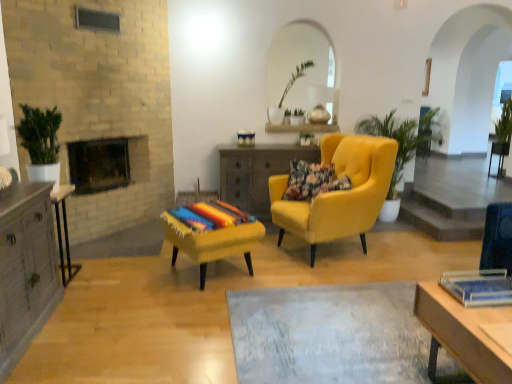
Question: Considering the positions of point (105, 142) and point (399, 152), is point (105, 142) closer or farther from the camera than point (399, 152)?

Choices:
 (A) closer
 (B) farther

Answer: (A)

Question: In terms of size, does brick fireplace at center-left appear bigger or smaller than green leafy plant at center, which is the second houseplant in front-to-back order?

Choices:
 (A) small
 (B) big

Answer: (A)

Question: Estimate the real-world distances between objects in this image. Which object is farther from the green glossy plant at left, which is counted as the third houseplant, starting from the right?

Choices:
 (A) green leafy plant at center, marked as the second plant in a top-to-bottom arrangement
 (B) floral fabric pillow at center
 (C) wooden cabinet at left, which is counted as the 1th table, starting from the left
 (D) wooden side table at center, the 1th table when ordered from back to front
 (E) velvet yellow stool at center

Answer: (A)

Question: Which of these objects is positioned closest to the green leafy plant at center, positioned as the 1th plant in front-to-back order?

Choices:
 (A) velvet yellow stool at center
 (B) green leafy plant at center, which is the third houseplant from left to right
 (C) yellow fabric armchair at center
 (D) green glossy plant at left, which is the 1th houseplant from left to right
 (E) floral fabric pillow at center

Answer: (B)